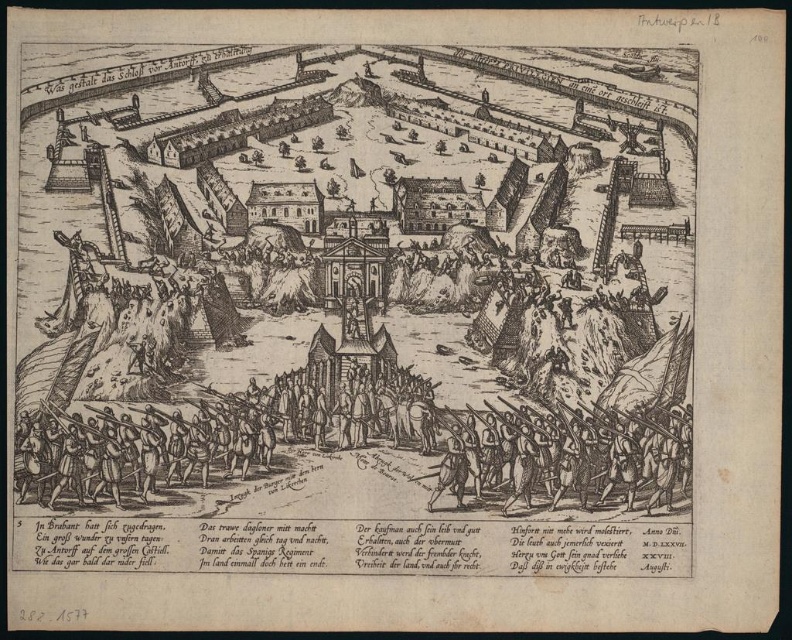
You are a photographer standing at the camera position. You want to take a photo of the wooden soldiers at center. Can you fit them all in your viewfinder if your camera has a 50mm lens with a field of view of 46 degrees?

The wooden soldiers at center and camera are 106.08 meters apart from each other. With a 50mm lens and a 46 degree field of view, the maximum width you can capture at that distance is approximately 106.08 meters multiplied by the tangent of 23 degrees, which is about 106.08 m x 0.424 equals 45 meters. Since the wooden soldiers are within this width, they can all fit in the viewfinder.

In the historical engraving, you notice two elements at the center of the scene. The wooden soldiers at center and the wooden spears at center. Which of these is positioned to the right of the other?

The wooden soldiers at center are to the right of the wooden spears at center.

You are a soldier positioned at point A, which is at coordinates point (282,100), and you need to reach point B, located at coordinates point (686,468). Considering the terrain and structures in the scene, which direction should you move to get closer to your destination?

To move from point A at point (282,100) to point B at point (686,468), you should move towards the lower right direction since point A is closer to the camera than point B, indicating it is further ahead in the scene.